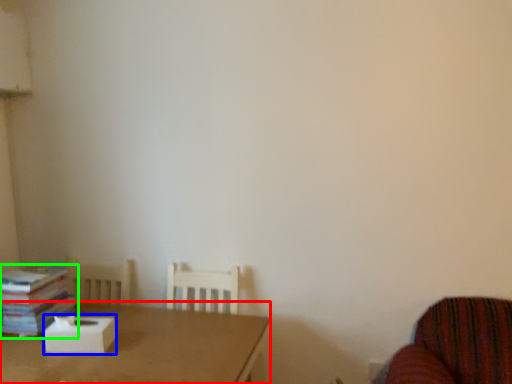
Question: Considering the real-world distances, which object is farthest from table (highlighted by a red box)? cardboard box (highlighted by a blue box) or book (highlighted by a green box)?

Choices:
 (A) cardboard box
 (B) book

Answer: (B)